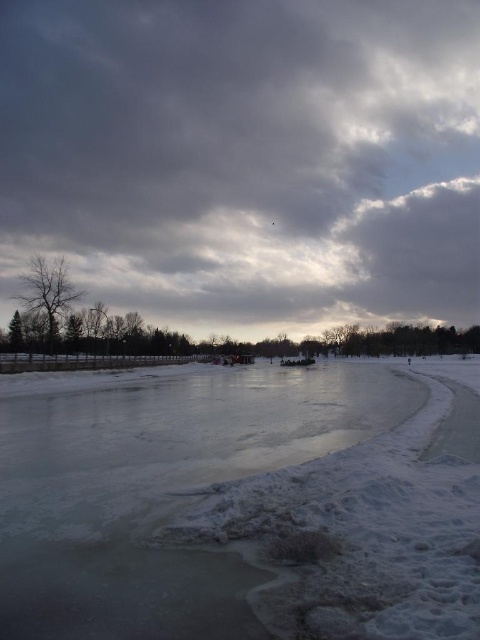
Question: Which of the following is the farthest from the observer?

Choices:
 (A) white ice at center
 (B) gray cloudy sky at upper center

Answer: (B)

Question: Which point appears closest to the camera in this image?

Choices:
 (A) (350, 244)
 (B) (286, 592)

Answer: (B)

Question: From the image, what is the correct spatial relationship of gray cloudy sky at upper center in relation to white ice at center?

Choices:
 (A) left
 (B) right

Answer: (A)

Question: Which point is closer to the camera?

Choices:
 (A) (344, 561)
 (B) (36, 150)

Answer: (A)

Question: Does gray cloudy sky at upper center appear under white ice at center?

Choices:
 (A) no
 (B) yes

Answer: (A)

Question: Where is gray cloudy sky at upper center located in relation to white ice at center in the image?

Choices:
 (A) right
 (B) left

Answer: (B)